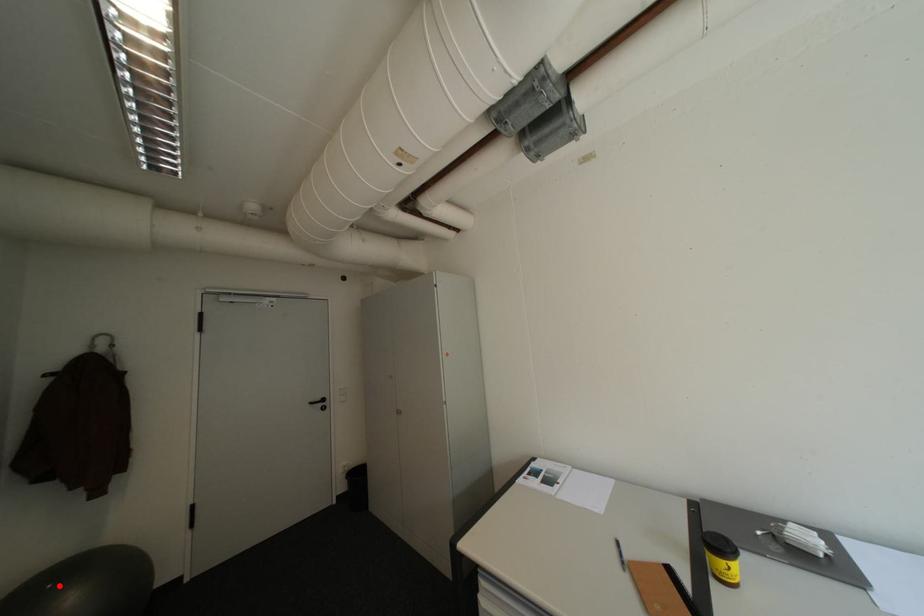
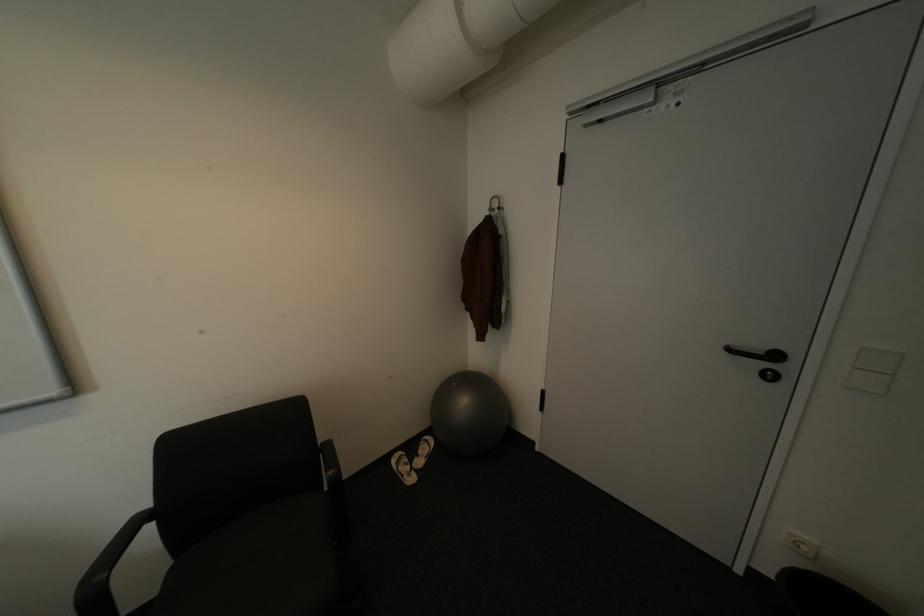
Question: A red point is marked in image1. In image2, is the corresponding 3D point closer to the camera or farther? Reply with the corresponding letter.

Choices:
 (A) The corresponding 3D point is closer.
 (B) The corresponding 3D point is farther.

Answer: (A)